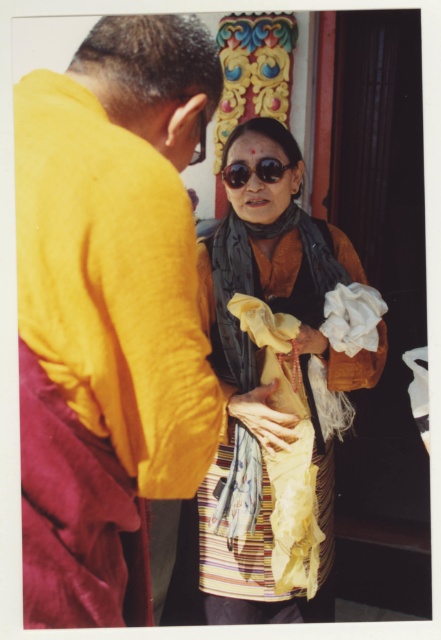
Is yellow cotton robe at center taller than matte black sunglasses at center?

Yes.

Is yellow cotton robe at center further to the viewer compared to matte black sunglasses at center?

No, it is in front of matte black sunglasses at center.

What do you see at coordinates (122, 243) in the screenshot? The width and height of the screenshot is (441, 640). I see `yellow cotton robe at center` at bounding box center [122, 243].

At what (x,y) coordinates should I click in order to perform the action: click on yellow cotton robe at center. Please return your answer as a coordinate pair (x, y). The height and width of the screenshot is (640, 441). Looking at the image, I should click on (122, 243).

Does point (321, 300) come behind point (261, 157)?

Yes, point (321, 300) is behind point (261, 157).

Who is shorter, textured yellow fabric at center or matte black sunglasses at center?

Standing shorter between the two is matte black sunglasses at center.

The width and height of the screenshot is (441, 640). What do you see at coordinates (280, 388) in the screenshot? I see `textured yellow fabric at center` at bounding box center [280, 388].

The image size is (441, 640). In order to click on textured yellow fabric at center in this screenshot , I will do `click(280, 388)`.

Measure the distance between yellow cotton robe at center and camera.

yellow cotton robe at center is 39.17 inches from camera.

Is yellow cotton robe at center to the left of textured yellow fabric at center from the viewer's perspective?

Correct, you'll find yellow cotton robe at center to the left of textured yellow fabric at center.

Is point (118, 291) more distant than point (266, 216)?

No, (118, 291) is in front of (266, 216).

Identify the location of yellow cotton robe at center. This screenshot has width=441, height=640. (122, 243).